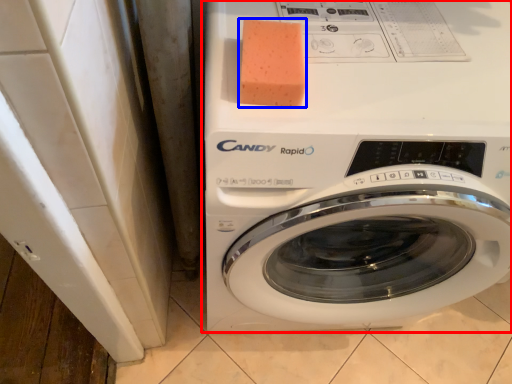
Question: Which object is closer to the camera taking this photo, washing machine (highlighted by a red box) or soap (highlighted by a blue box)?

Choices:
 (A) washing machine
 (B) soap

Answer: (A)